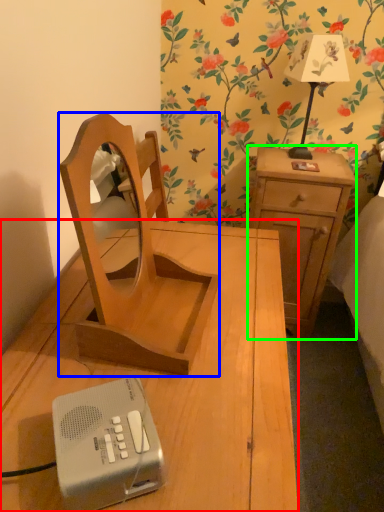
Question: Which object is positioned closest to nightstand (highlighted by a red box)? Select from furniture (highlighted by a blue box) and nightstand (highlighted by a green box).

Choices:
 (A) furniture
 (B) nightstand

Answer: (A)